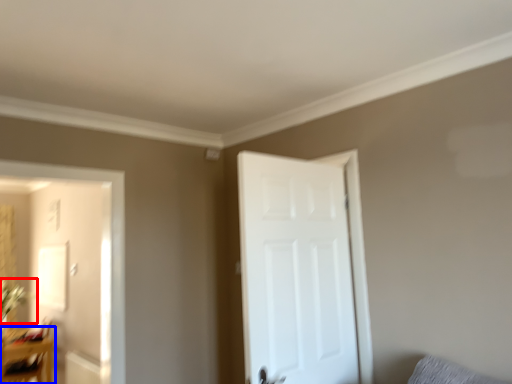
Question: Which object is closer to the camera taking this photo, plant (highlighted by a red box) or table (highlighted by a blue box)?

Choices:
 (A) plant
 (B) table

Answer: (B)